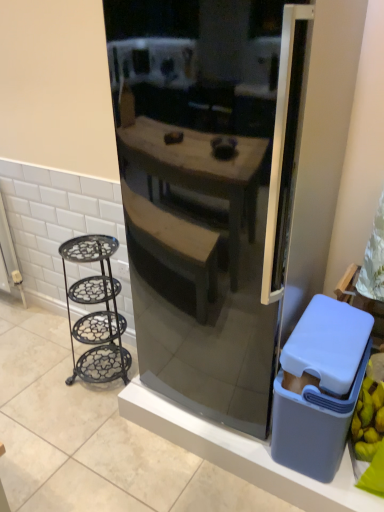
Question: From a real-world perspective, is satin black refrigerator at center located higher than black wrought iron stand at left?

Choices:
 (A) no
 (B) yes

Answer: (B)

Question: Are satin black refrigerator at center and black wrought iron stand at left making contact?

Choices:
 (A) no
 (B) yes

Answer: (A)

Question: Is satin black refrigerator at center facing towards black wrought iron stand at left?

Choices:
 (A) no
 (B) yes

Answer: (A)

Question: Is satin black refrigerator at center turned away from black wrought iron stand at left?

Choices:
 (A) yes
 (B) no

Answer: (B)

Question: Can you confirm if satin black refrigerator at center is thinner than black wrought iron stand at left?

Choices:
 (A) yes
 (B) no

Answer: (B)

Question: From a real-world perspective, is satin black refrigerator at center positioned under black wrought iron stand at left based on gravity?

Choices:
 (A) no
 (B) yes

Answer: (A)

Question: Can you confirm if gray plastic bin at lower right is wider than gray plastic trash bin at right?

Choices:
 (A) no
 (B) yes

Answer: (A)

Question: Is gray plastic bin at lower right in front of gray plastic trash bin at right?

Choices:
 (A) no
 (B) yes

Answer: (A)

Question: Can you confirm if gray plastic bin at lower right is shorter than gray plastic trash bin at right?

Choices:
 (A) no
 (B) yes

Answer: (B)

Question: Can you confirm if gray plastic bin at lower right is taller than gray plastic trash bin at right?

Choices:
 (A) yes
 (B) no

Answer: (B)

Question: From a real-world perspective, is gray plastic bin at lower right located beneath gray plastic trash bin at right?

Choices:
 (A) yes
 (B) no

Answer: (A)

Question: Is gray plastic bin at lower right smaller than gray plastic trash bin at right?

Choices:
 (A) yes
 (B) no

Answer: (B)

Question: Can you confirm if black wrought iron stand at left is positioned to the right of gray plastic trash bin at right?

Choices:
 (A) yes
 (B) no

Answer: (B)